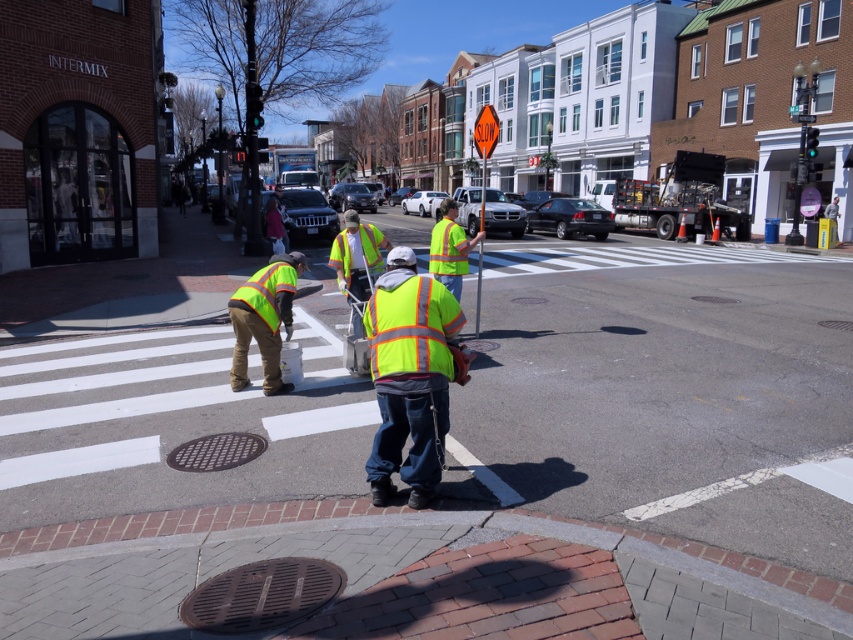
From the picture: You are a pedestrian crossing the street and see the yellow reflective safety vest at center and the orange reflective plastic at upper center. Which object is closer to you?

The yellow reflective safety vest at center is closer to you because it is in front of the orange reflective plastic at upper center.